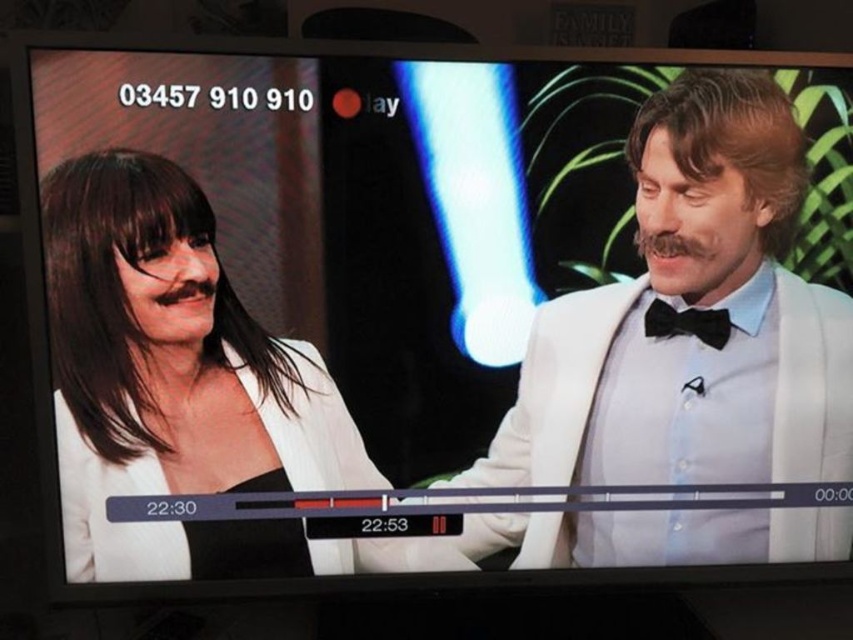
Question: Which point is farther from the camera taking this photo?

Choices:
 (A) [x=685, y=216]
 (B) [x=161, y=429]

Answer: (A)

Question: Which point is farther to the camera?

Choices:
 (A) (708, 237)
 (B) (143, 538)
 (C) (651, 328)

Answer: (C)

Question: Does white satin suit at right appear on the left side of matte white blazer at left?

Choices:
 (A) yes
 (B) no

Answer: (B)

Question: From the image, what is the correct spatial relationship of white satin suit at right in relation to black satin bow tie at right?

Choices:
 (A) below
 (B) above

Answer: (A)

Question: Where is white satin suit at right located in relation to matte white blazer at left in the image?

Choices:
 (A) above
 (B) below

Answer: (A)

Question: Based on their relative distances, which object is farther from the white satin suit at right?

Choices:
 (A) matte white blazer at left
 (B) black satin bow tie at right

Answer: (A)